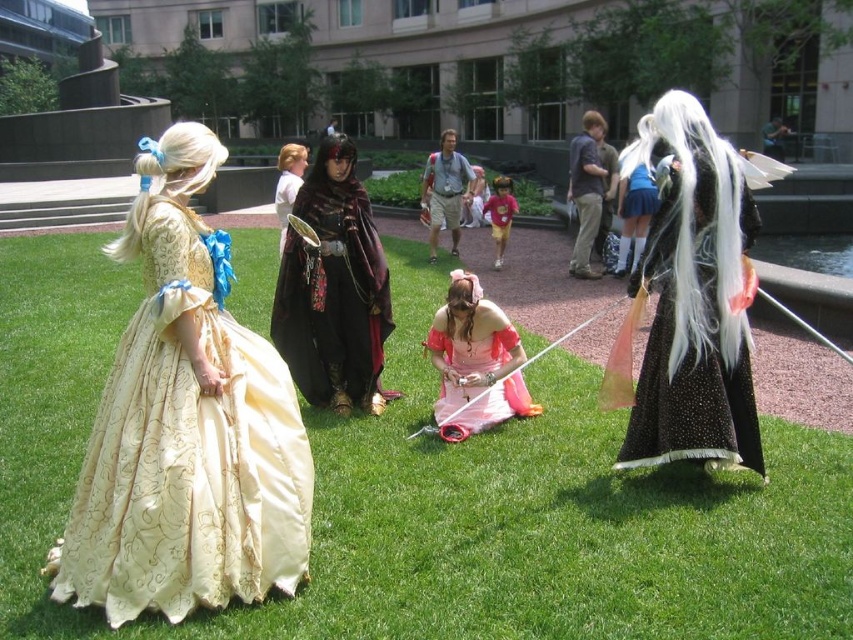
Looking at this image, between green grass at lower left and light brown leather backpack at center, which one is positioned lower?

Positioned lower is green grass at lower left.

Is point (727, 570) positioned in front of point (451, 241)?

Yes.

Identify the location of green grass at lower left. The height and width of the screenshot is (640, 853). (434, 496).

Does gold satin dress at left appear on the left side of velvet maroon cape at center?

Yes, gold satin dress at left is to the left of velvet maroon cape at center.

This screenshot has height=640, width=853. I want to click on gold satin dress at left, so click(186, 451).

Is light brown leather backpack at center wider than matte black armor at center?

In fact, light brown leather backpack at center might be narrower than matte black armor at center.

In the scene shown: Is light brown leather backpack at center bigger than matte black armor at center?

No.

Measure the distance between point (450,188) and camera.

A distance of 11.78 meters exists between point (450,188) and camera.

Where is `light brown leather backpack at center`? The image size is (853, 640). light brown leather backpack at center is located at coordinates (444, 192).